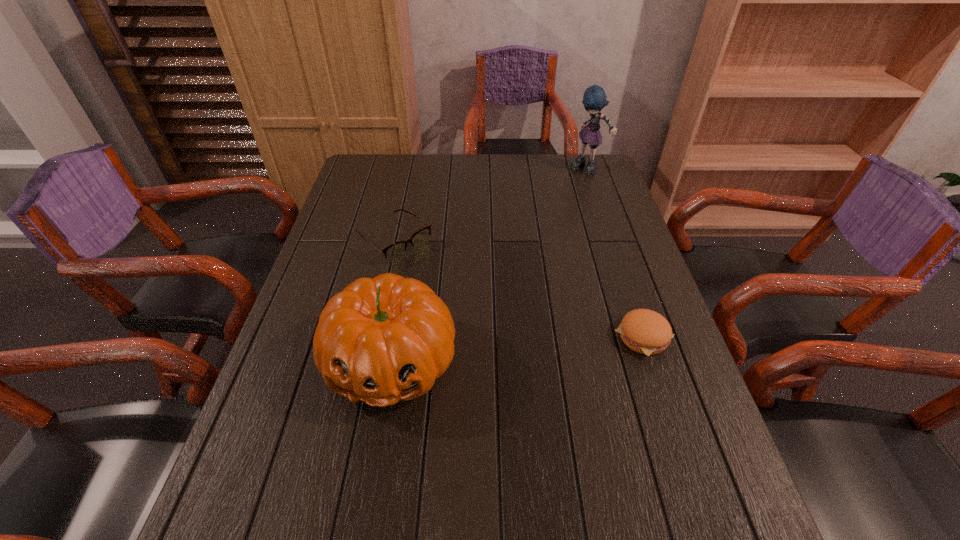
The image size is (960, 540). Identify the location of unoccupied position between the farthest object and the patty. (615, 253).

Locate an element on the screen. Image resolution: width=960 pixels, height=540 pixels. unoccupied position between the patty and the second tallest object is located at coordinates (516, 348).

Locate an element on the screen. Image resolution: width=960 pixels, height=540 pixels. object identified as the second closest to the spectacles is located at coordinates (647, 332).

Where is `object that is the third closest to the third shortest object`? The height and width of the screenshot is (540, 960). object that is the third closest to the third shortest object is located at coordinates (594, 99).

The image size is (960, 540). I want to click on vacant area that satisfies the following two spatial constraints: 1. on the back side of the tallest object; 2. on the left side of the third nearest object, so click(x=410, y=169).

Identify the location of free location that satisfies the following two spatial constraints: 1. on the back side of the patty; 2. on the right side of the farthest object. The height and width of the screenshot is (540, 960). (587, 169).

In order to click on free location that satisfies the following two spatial constraints: 1. on the back side of the rag doll; 2. on the left side of the spectacles in this screenshot , I will do `click(410, 169)`.

Locate an element on the screen. This screenshot has height=540, width=960. vacant position in the image that satisfies the following two spatial constraints: 1. on the back side of the patty; 2. on the left side of the tallest object is located at coordinates (587, 169).